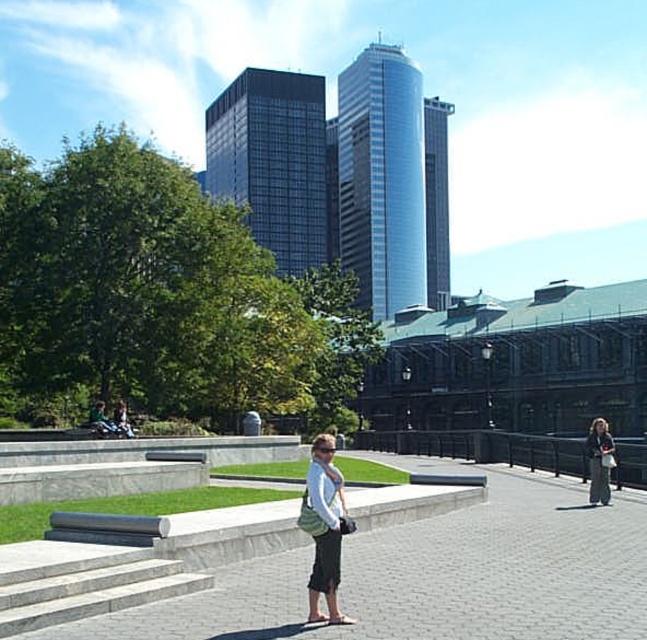
Identify the location of gray concrete stairs at lower left. The height and width of the screenshot is (640, 647). (82, 580).

Is gray concrete stairs at lower left further to camera compared to gray fabric pants at right?

No, it is in front of gray fabric pants at right.

Is point (137, 596) less distant than point (608, 474)?

Yes, it is.

This screenshot has width=647, height=640. I want to click on gray concrete stairs at lower left, so click(82, 580).

In the scene shown: Does green fabric bag at center have a lesser width compared to gray fabric pants at right?

Correct, green fabric bag at center's width is less than gray fabric pants at right's.

Does green fabric bag at center come behind gray fabric pants at right?

No.

Which is behind, point (316, 509) or point (589, 442)?

The point (589, 442) is behind.

This screenshot has width=647, height=640. I want to click on green fabric bag at center, so click(x=324, y=529).

At what (x,y) coordinates should I click in order to perform the action: click on gray concrete stairs at lower left. Please return your answer as a coordinate pair (x, y). The height and width of the screenshot is (640, 647). Looking at the image, I should click on (82, 580).

Between gray concrete stairs at lower left and green fabric bag at center, which one has less height?

gray concrete stairs at lower left

Which is behind, point (144, 556) or point (336, 536)?

Positioned behind is point (144, 556).

Locate an element on the screen. This screenshot has width=647, height=640. gray concrete stairs at lower left is located at coordinates (82, 580).